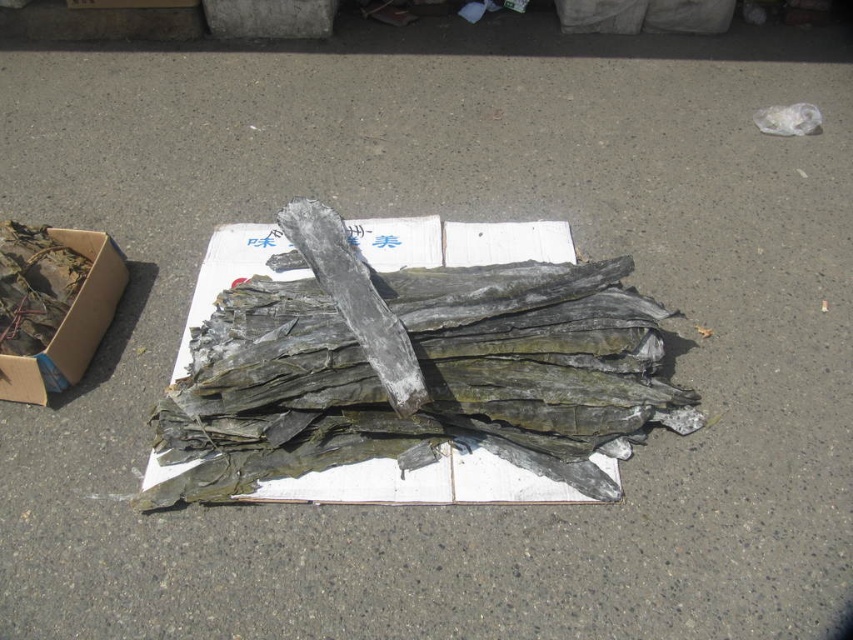
Question: Is greenish-gray wood at center above brown cardboard box at left?

Choices:
 (A) no
 (B) yes

Answer: (A)

Question: Where is greenish-gray wood at center located in relation to brown cardboard box at left in the image?

Choices:
 (A) below
 (B) above

Answer: (A)

Question: Among these objects, which one is nearest to the camera?

Choices:
 (A) greenish-gray wood at center
 (B) brown cardboard box at left

Answer: (A)

Question: Among these points, which one is nearest to the camera?

Choices:
 (A) (15, 384)
 (B) (314, 400)

Answer: (B)

Question: Considering the relative positions of greenish-gray wood at center and brown cardboard box at left in the image provided, where is greenish-gray wood at center located with respect to brown cardboard box at left?

Choices:
 (A) below
 (B) above

Answer: (A)